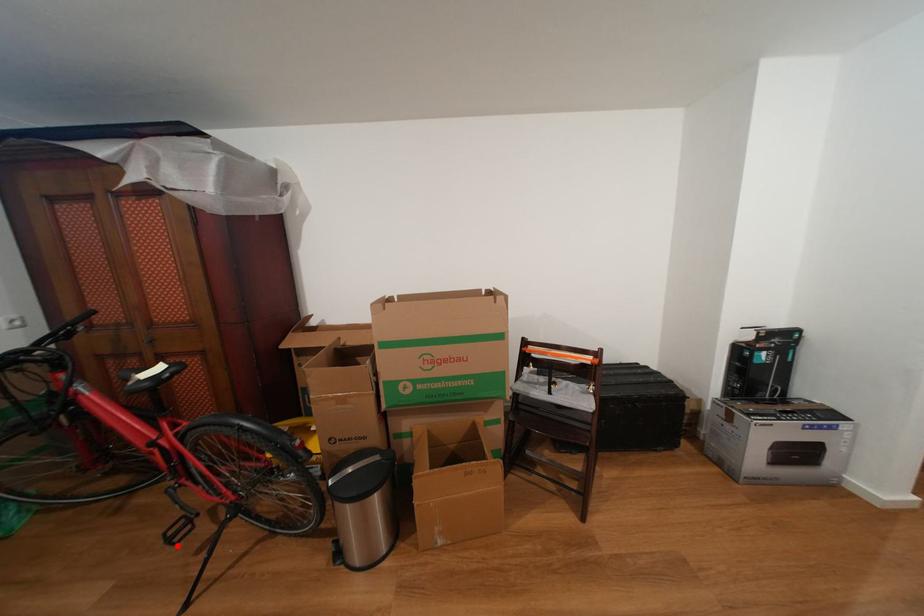
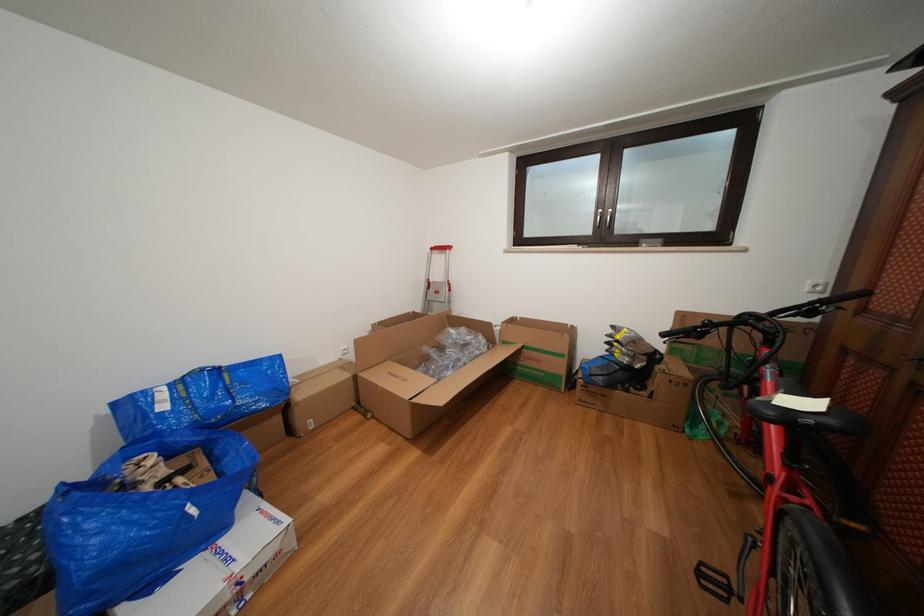
Question: I am providing you with two images of the same scene from different viewpoints. In image1, a red point is highlighted. Considering the same 3D point in image2, which of the following is correct?

Choices:
 (A) It is closer
 (B) It is farther

Answer: (B)